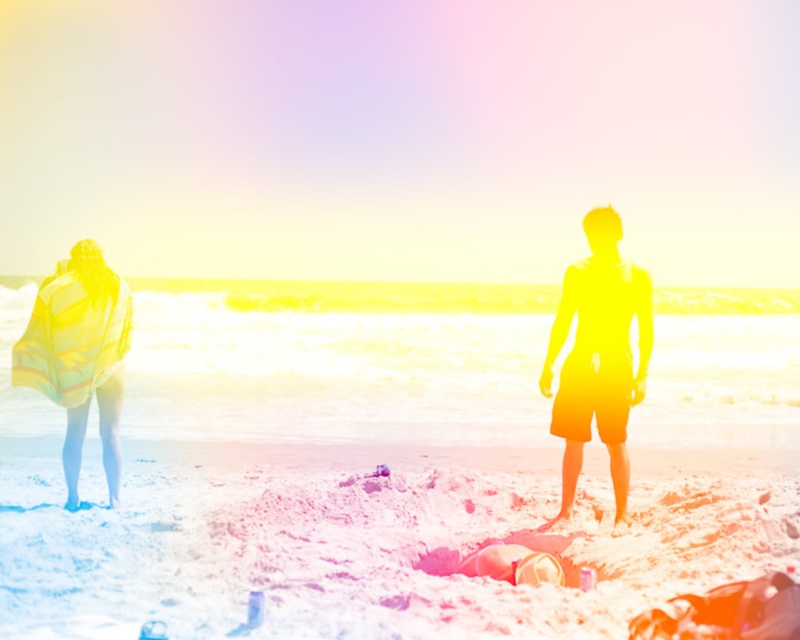
You are a photographer trying to capture the two subjects in the beach scene. Since the silhouette shorts at center and the yellow striped towel at left are both in the frame, which one would appear larger in your photo?

The silhouette shorts at center would appear larger in the photo because it is bigger than the yellow striped towel at left according to the description.

Based on the photo, you are a photographer aiming to capture the silhouette shorts at center and the white sandy beach at center in your shot. Based on their positions, which object should you adjust your camera focus to first to ensure both are in frame?

The white sandy beach at center is to the left of the silhouette shorts at center, so you should focus on the silhouette shorts at center first as it is closer to the right side, allowing you to adjust the frame to include both objects.